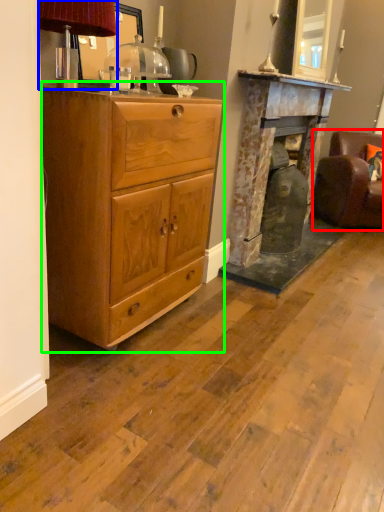
Question: Which object is the farthest from swivel chair (highlighted by a red box)? Choose among these: table lamp (highlighted by a blue box) or chest of drawers (highlighted by a green box).

Choices:
 (A) table lamp
 (B) chest of drawers

Answer: (A)